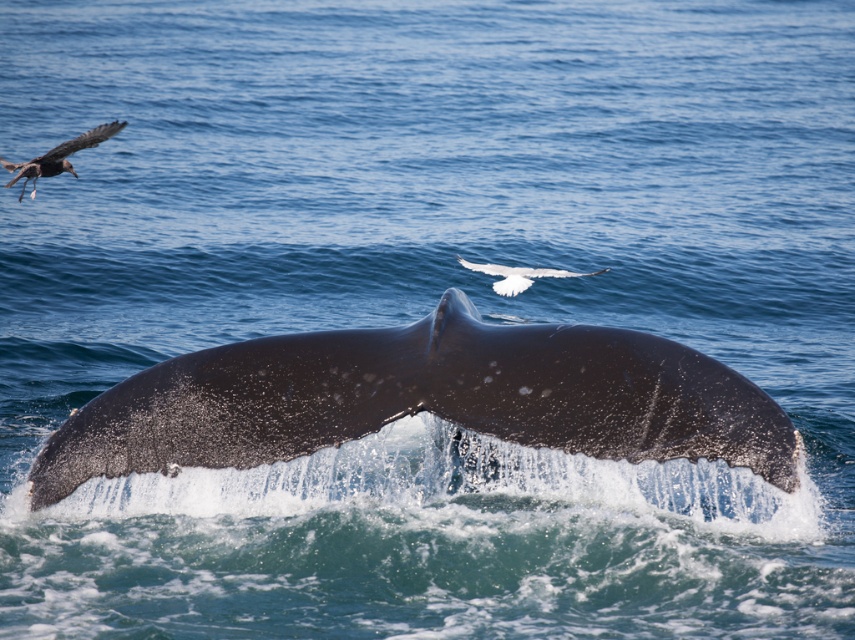
Which of these two, shiny black bird at upper left or white feathered bird at upper center, stands taller?

shiny black bird at upper left is taller.

Can you confirm if shiny black bird at upper left is smaller than white feathered bird at upper center?

Incorrect, shiny black bird at upper left is not smaller in size than white feathered bird at upper center.

Describe the element at coordinates (57, 156) in the screenshot. This screenshot has height=640, width=855. I see `shiny black bird at upper left` at that location.

Identify the location of shiny black bird at upper left. The image size is (855, 640). (57, 156).

Is point (727, 435) positioned before point (71, 168)?

Yes, point (727, 435) is closer to viewer.

Which of these two, dark gray textured tail fin at center or shiny black bird at upper left, stands taller?

With more height is shiny black bird at upper left.

You are a GUI agent. You are given a task and a screenshot of the screen. Output one action in this format:
    pyautogui.click(x=<x>, y=<y>)
    Task: Click on the dark gray textured tail fin at center
    Image resolution: width=855 pixels, height=640 pixels.
    Given the screenshot: What is the action you would take?
    pyautogui.click(x=422, y=400)

Who is more forward, (721, 392) or (498, 266)?

Point (721, 392) is more forward.

Which is behind, point (337, 400) or point (550, 268)?

Positioned behind is point (550, 268).

Where is `dark gray textured tail fin at center`? This screenshot has height=640, width=855. dark gray textured tail fin at center is located at coordinates (422, 400).

At what (x,y) coordinates should I click in order to perform the action: click on dark gray textured tail fin at center. Please return your answer as a coordinate pair (x, y). This screenshot has width=855, height=640. Looking at the image, I should click on (422, 400).